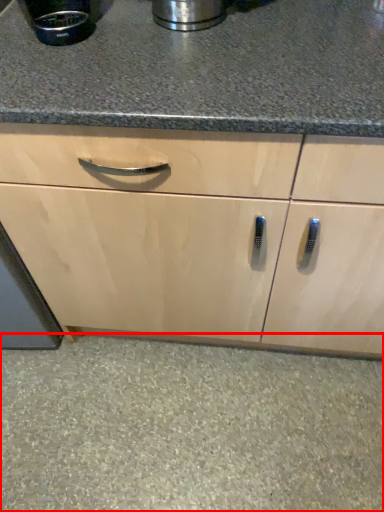
Question: From the image's perspective, what is the correct spatial relationship of granite (annotated by the red box) in relation to appliance?

Choices:
 (A) above
 (B) below

Answer: (B)